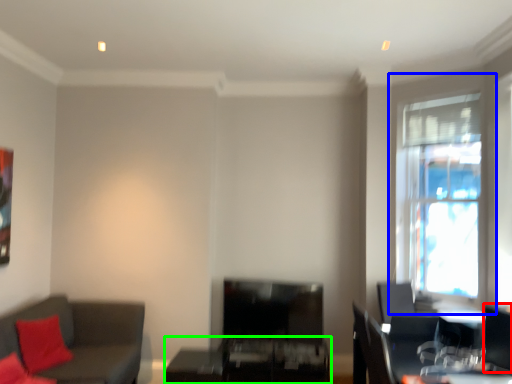
Question: Which is farther away from swivel chair (highlighted by a red box)? window (highlighted by a blue box) or table (highlighted by a green box)?

Choices:
 (A) window
 (B) table

Answer: (B)